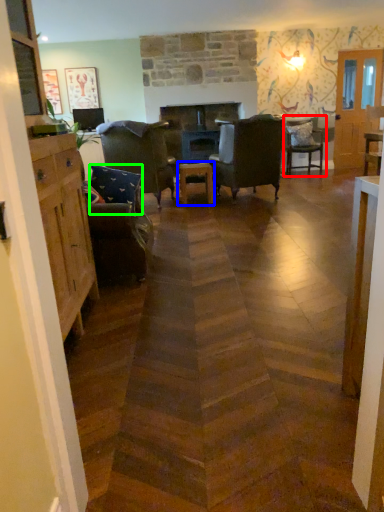
Question: Which is farther away from chair (highlighted by a red box)? table (highlighted by a blue box) or pillow (highlighted by a green box)?

Choices:
 (A) table
 (B) pillow

Answer: (B)